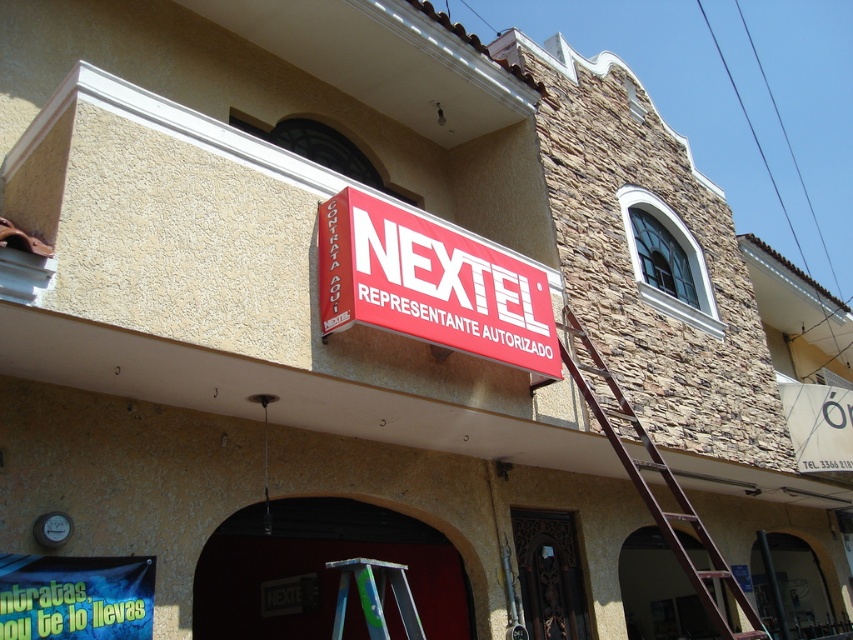
Which of these two, brown wooden ladder at right or silver metallic ladder at center, stands shorter?

silver metallic ladder at center is shorter.

Is brown wooden ladder at right in front of silver metallic ladder at center?

No, it is behind silver metallic ladder at center.

Locate an element on the screen. This screenshot has width=853, height=640. brown wooden ladder at right is located at coordinates (665, 483).

Does red plastic sign at center come behind silver metallic ladder at center?

Yes, it is behind silver metallic ladder at center.

Who is shorter, red plastic sign at center or silver metallic ladder at center?

With less height is silver metallic ladder at center.

In order to click on red plastic sign at center in this screenshot , I will do `click(431, 285)`.

Which of these two, red plastic sign at center or brown wooden ladder at right, stands taller?

Standing taller between the two is brown wooden ladder at right.

This screenshot has width=853, height=640. What do you see at coordinates (431, 285) in the screenshot? I see `red plastic sign at center` at bounding box center [431, 285].

Locate an element on the screen. The width and height of the screenshot is (853, 640). red plastic sign at center is located at coordinates (431, 285).